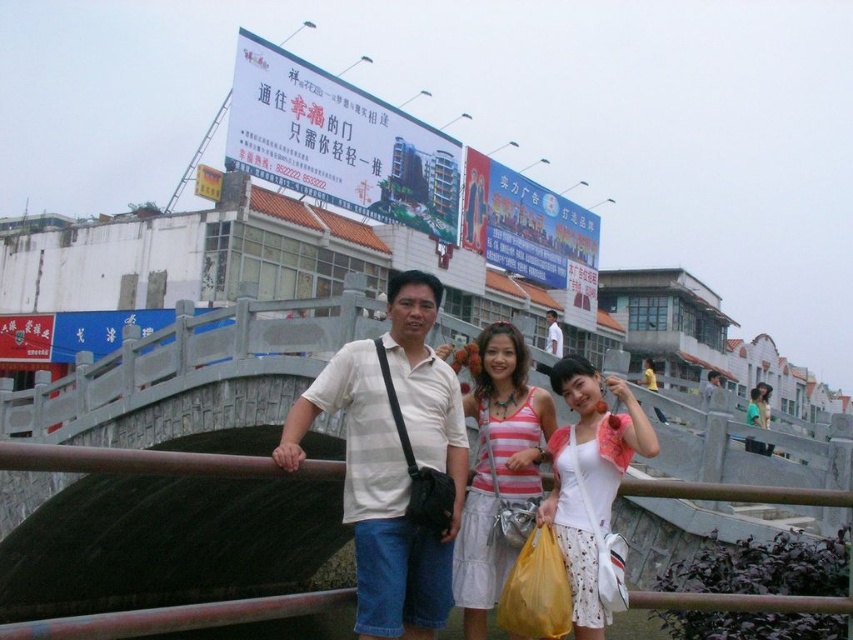
You are a photographer trying to frame a group photo of the white striped shirt at center and the matte white tank top at center. Since you want to ensure both subjects are equally visible, which subject should you position closer to the camera to achieve this?

The white striped shirt at center should be positioned closer to the camera because its width is less than the matte white tank top at center, so bringing it forward will balance their visibility in the frame.